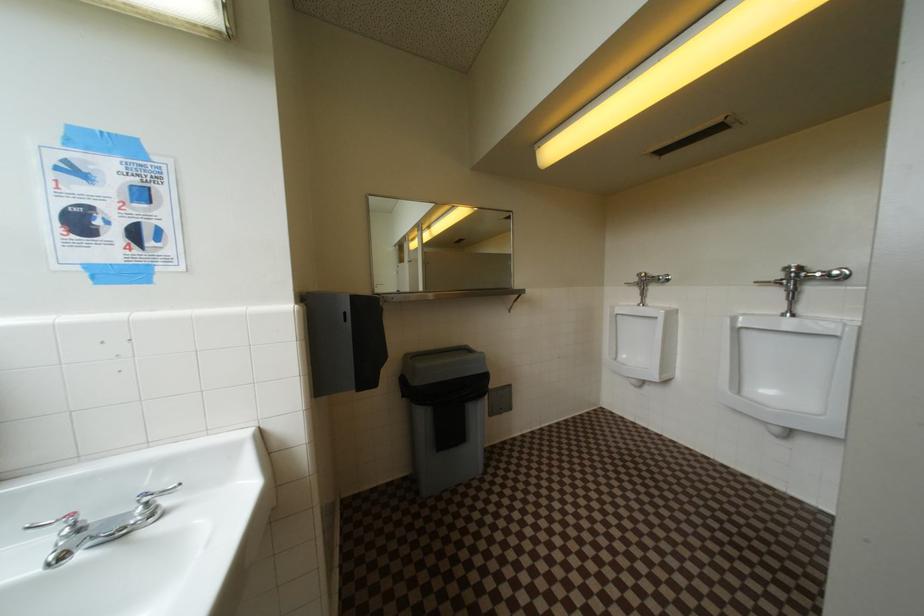
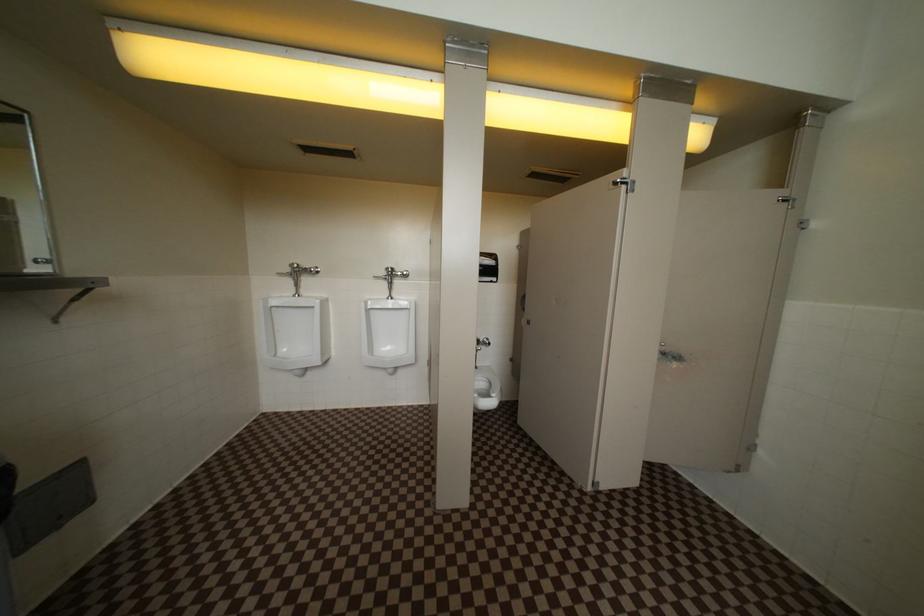
Question: The camera is either moving clockwise (left) or counter-clockwise (right) around the object. The first image is from the beginning of the video and the second image is from the end. Is the camera moving left or right when shooting the video?

Choices:
 (A) Left
 (B) Right

Answer: (A)